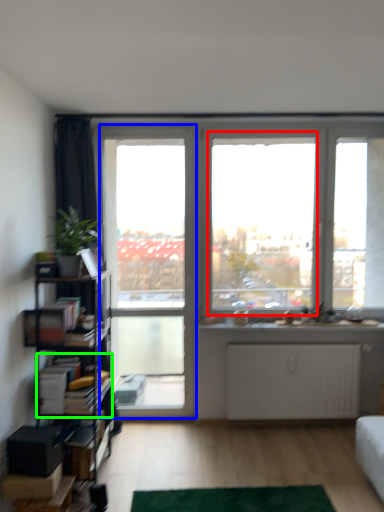
Question: Which object is positioned closest to window screen (highlighted by a red box)? Select from screen door (highlighted by a blue box) and book (highlighted by a green box).

Choices:
 (A) screen door
 (B) book

Answer: (A)